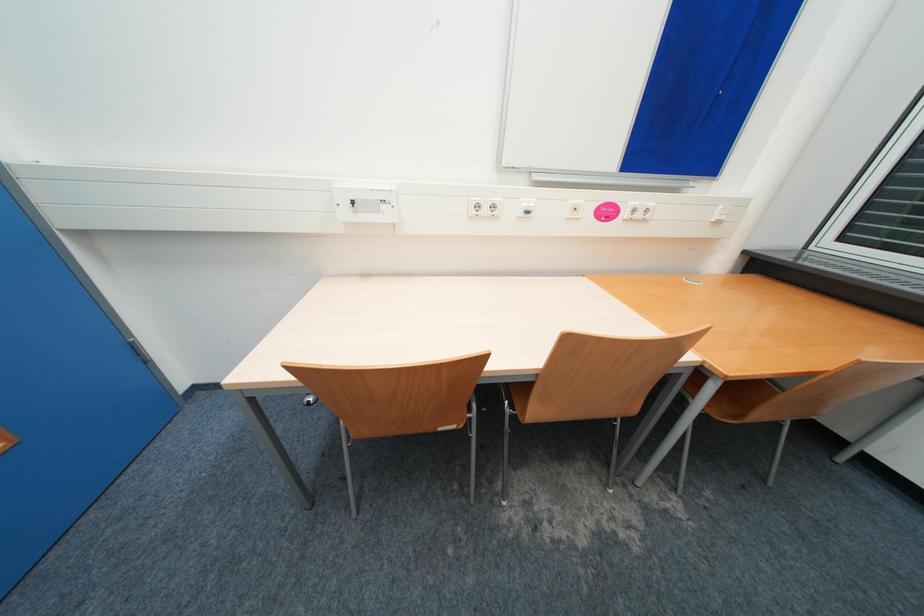
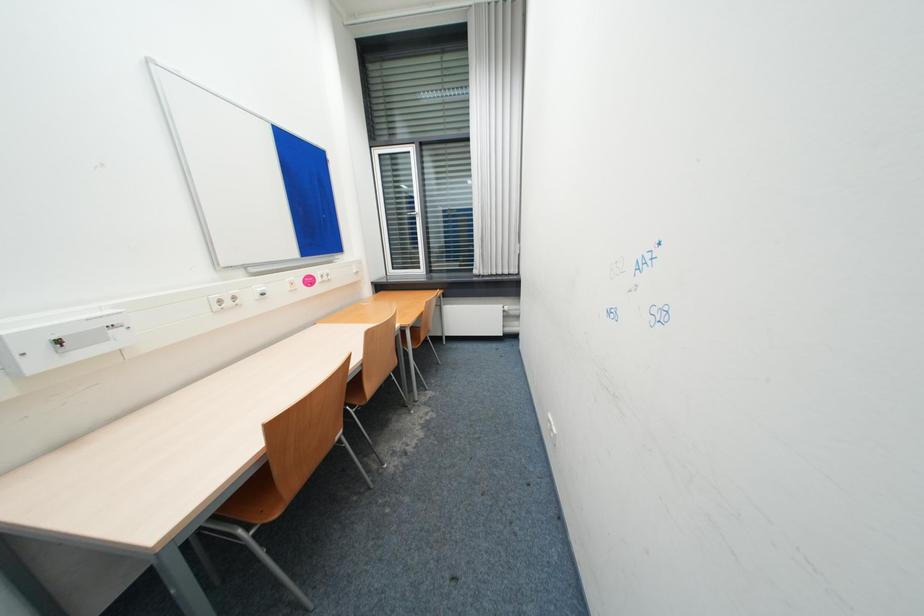
Question: The first image is from the beginning of the video and the second image is from the end. How did the camera likely rotate when shooting the video?

Choices:
 (A) Left
 (B) Right
 (C) Up
 (D) Down

Answer: (B)